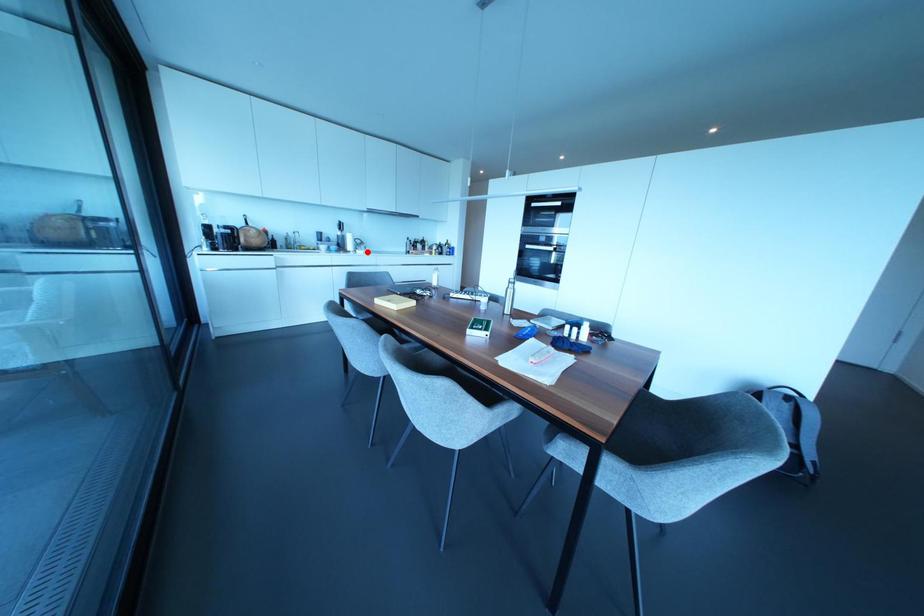
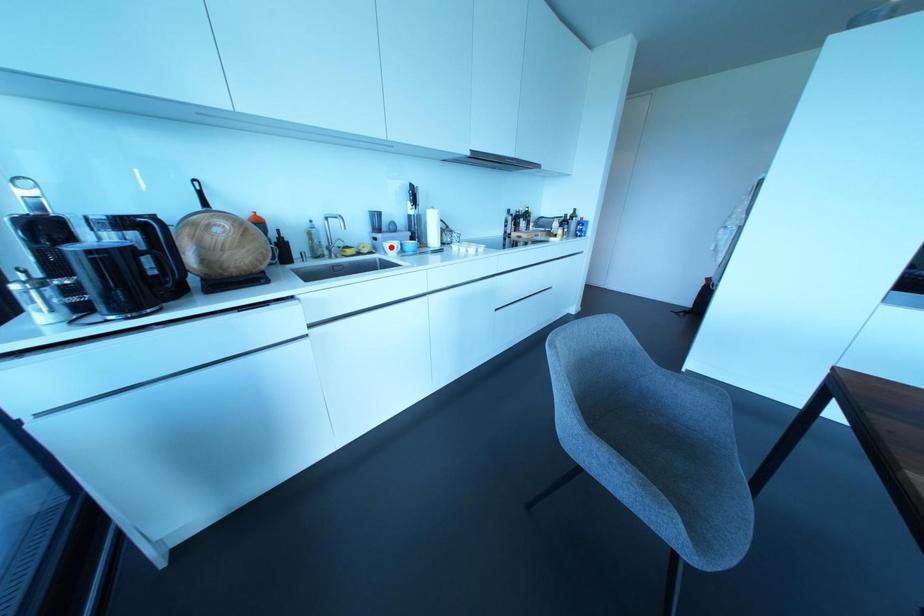
I am providing you with two images of the same scene from different viewpoints. A red point is marked on the first image and another point is marked on the second image. Are the points marked in image1 and image2 representing the same 3D position?

No